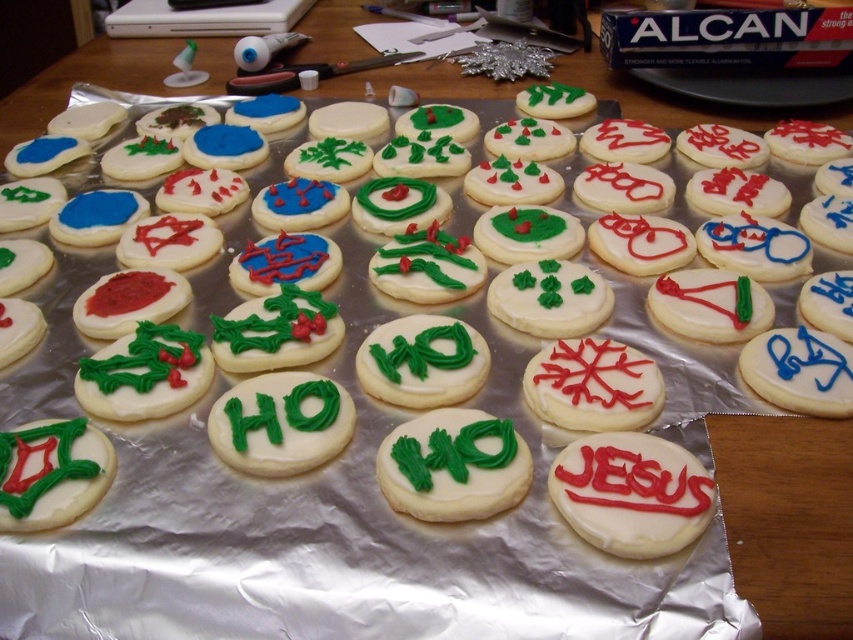
You are a baker who wants to place both the green frosted cookie with white icing at center and the green frosting cookie at center on a dessert platter. Which cookie should you place first to ensure they both fit on the platter?

The green frosted cookie with white icing at center is smaller than the green frosting cookie at center, so you should place the larger green frosting cookie at center first to ensure there is enough space for the smaller one.

You are a photographer who wants to capture a closeup shot of the white smooth cookie at center. If your camera requires the subject to be within 30 inches for optimal focus, will you need to move closer or farther away from the cookie?

The white smooth cookie at center is 33.40 inches away from the camera, which is beyond the 30 inches requirement for optimal focus. Therefore, you need to move closer to the cookie to achieve the best focus.